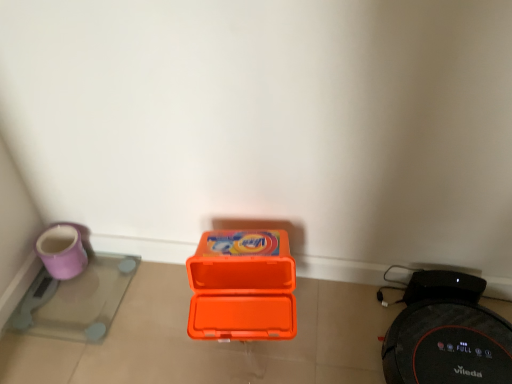
Identify the location of vacant area to the left of black rubber robot vacuum cleaner at lower right, marked as the 1th appliance in a right-to-left arrangement. point(339,331).